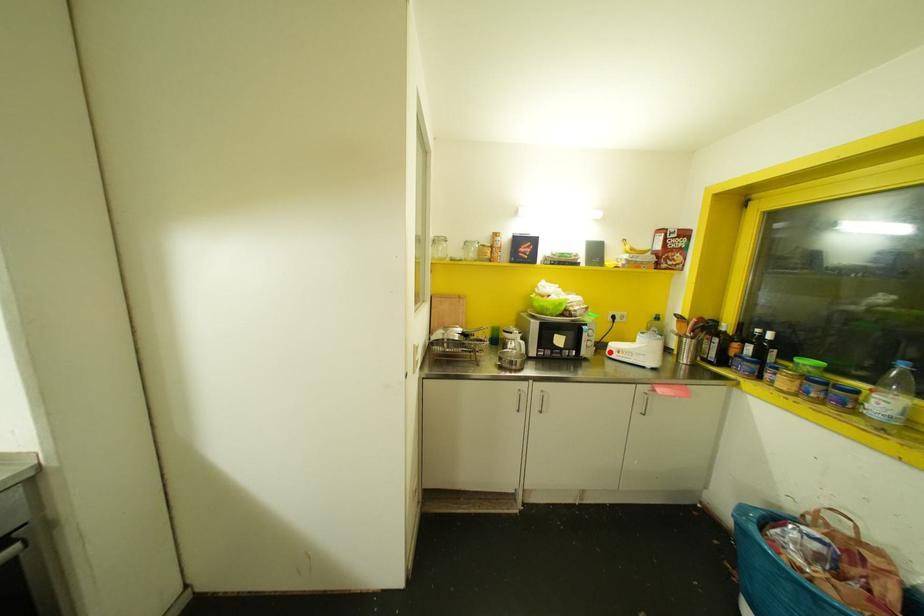
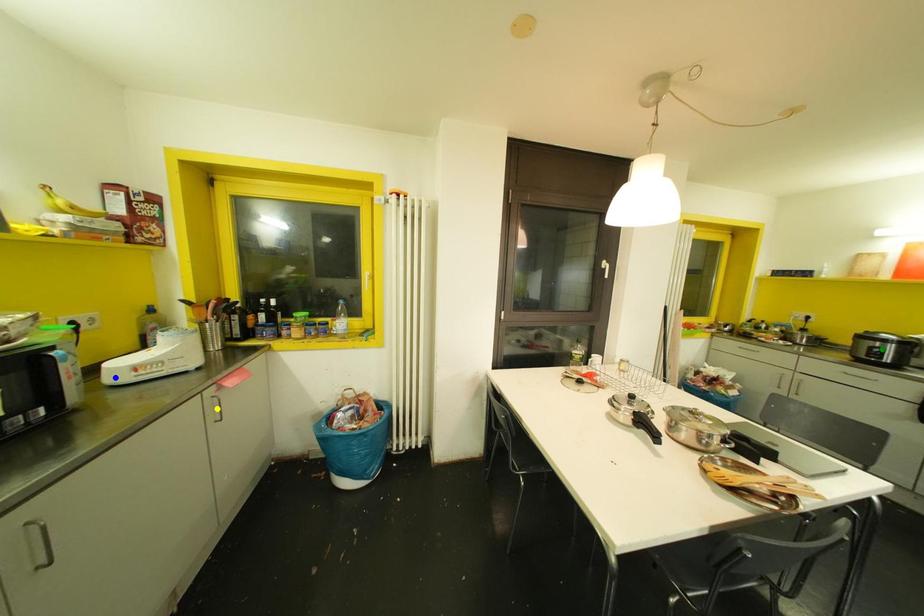
Question: I am providing you with two images of the same scene from different viewpoints. A red point is marked on the first image. You are given multiple points on the second image. Which spot in image 2 lines up with the point in image 1?

Choices:
 (A) green point
 (B) yellow point
 (C) blue point

Answer: (C)